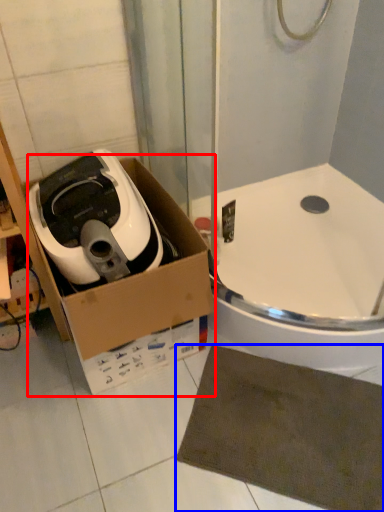
Question: Which object is further to the camera taking this photo, cardboard box (highlighted by a red box) or bath mat (highlighted by a blue box)?

Choices:
 (A) cardboard box
 (B) bath mat

Answer: (B)